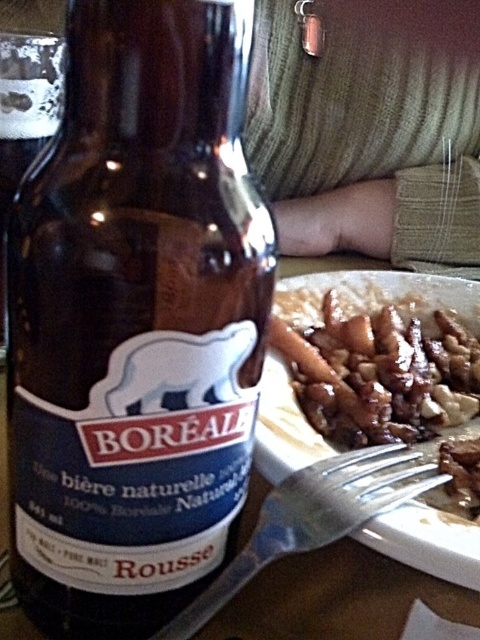
Based on the photo, you are a server in a restaurant and need to place a new order on the table. The table already has a brown glass bottle at center and a silver metallic fork at lower center. Which item should you avoid placing a heavy object on top of to prevent damage?

You should avoid placing a heavy object on top of the brown glass bottle at center because it is larger in size than the silver metallic fork at lower center, making it more susceptible to damage from heavy items.